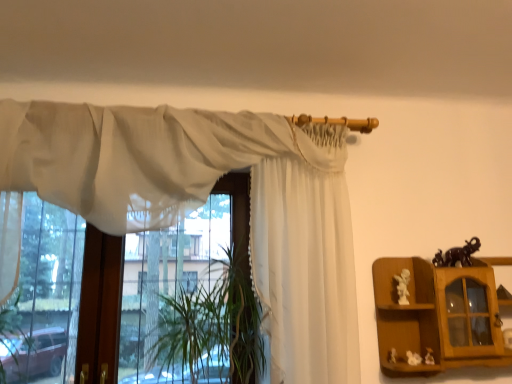
Question: Looking at the image, does white glossy statue at right, the 3th toy from the right, seem bigger or smaller compared to wooden cabinet at right?

Choices:
 (A) small
 (B) big

Answer: (A)

Question: Considering the positions of white glossy statue at right, the 3th toy from the right, and wooden cabinet at right in the image, is white glossy statue at right, the 3th toy from the right, taller or shorter than wooden cabinet at right?

Choices:
 (A) short
 (B) tall

Answer: (A)

Question: Which object is positioned farthest from the white glossy statue at right, the 3th toy from the right?

Choices:
 (A) white sheer curtain at center, positioned as the 1th curtain in right-to-left order
 (B) sheer white curtain at upper center, positioned as the second curtain in right-to-left order
 (C) white porcelain statue at lower right, positioned as the fourth toy in right-to-left order
 (D) green leafy plant at center
 (E) black glossy elephant at upper right, positioned as the first toy in top-to-bottom order

Answer: (B)

Question: Estimate the real-world distances between objects in this image. Which object is closer to the green leafy plant at center?

Choices:
 (A) sheer white curtain at upper center, the first curtain positioned from the left
 (B) white matte figurine at lower right, which ranks as the second toy in right-to-left order
 (C) black glossy elephant at upper right, placed as the fourth toy when sorted from bottom to top
 (D) white sheer curtain at center, positioned as the 1th curtain in right-to-left order
 (E) wooden cabinet at right

Answer: (D)